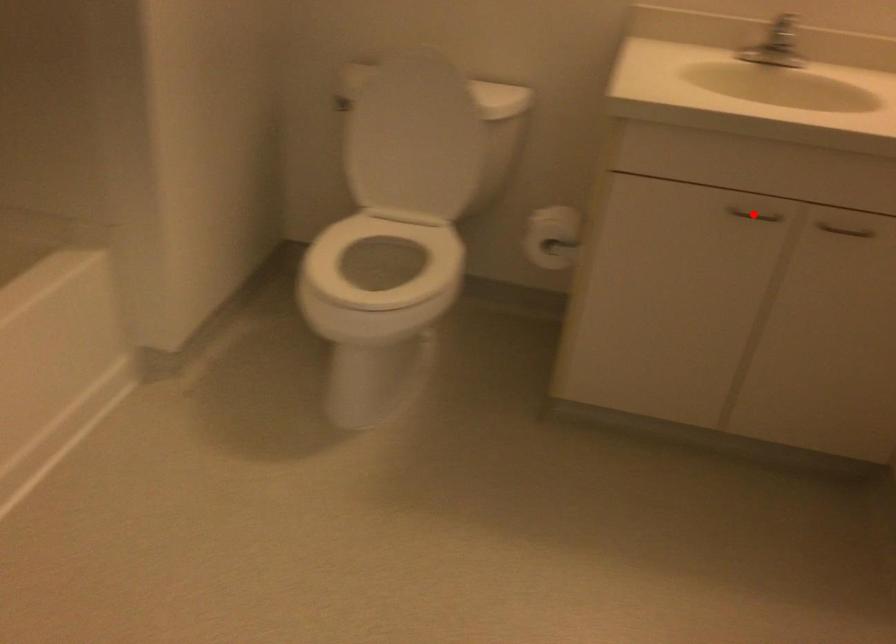
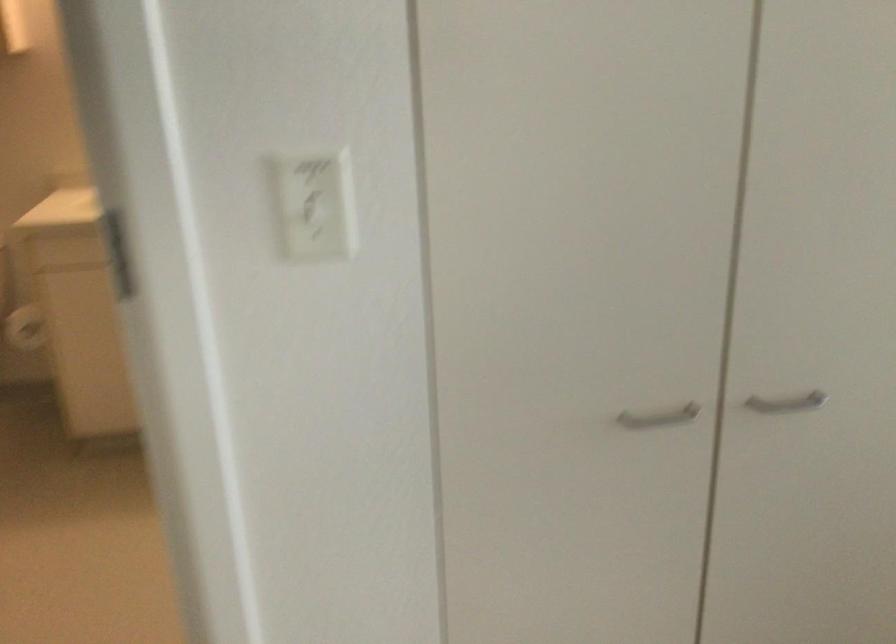
Question: I am providing you with two images of the same scene from different viewpoints. A red point is marked on the first image. Can you still see the location of the red point in image 2?

Choices:
 (A) Yes
 (B) No

Answer: (B)